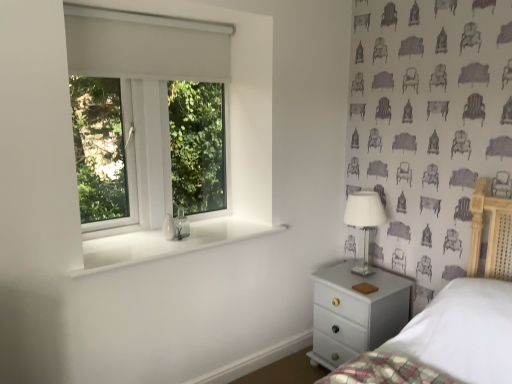
Question: From a real-world perspective, is white glossy chest of drawers at lower right beneath white plastic window at upper left?

Choices:
 (A) no
 (B) yes

Answer: (B)

Question: Is white glossy chest of drawers at lower right positioned before white plastic window at upper left?

Choices:
 (A) yes
 (B) no

Answer: (B)

Question: Does white glossy chest of drawers at lower right touch white plastic window at upper left?

Choices:
 (A) no
 (B) yes

Answer: (A)

Question: From a real-world perspective, is white glossy chest of drawers at lower right on top of white plastic window at upper left?

Choices:
 (A) no
 (B) yes

Answer: (A)

Question: Would you say white glossy chest of drawers at lower right is a long distance from white plastic window at upper left?

Choices:
 (A) no
 (B) yes

Answer: (A)

Question: In the image, is white glossy chest of drawers at lower right positioned in front of or behind white glass table lamp at right?

Choices:
 (A) front
 (B) behind

Answer: (A)

Question: Considering the positions of white glossy chest of drawers at lower right and white glass table lamp at right in the image, is white glossy chest of drawers at lower right taller or shorter than white glass table lamp at right?

Choices:
 (A) tall
 (B) short

Answer: (A)

Question: Is white glossy chest of drawers at lower right to the left or to the right of white glass table lamp at right in the image?

Choices:
 (A) right
 (B) left

Answer: (B)

Question: Is white glossy chest of drawers at lower right wider or thinner than white glass table lamp at right?

Choices:
 (A) wide
 (B) thin

Answer: (A)

Question: Considering the relative positions of white glass table lamp at right and white glossy chest of drawers at lower right in the image provided, is white glass table lamp at right to the left or to the right of white glossy chest of drawers at lower right?

Choices:
 (A) left
 (B) right

Answer: (B)

Question: In terms of height, does white glass table lamp at right look taller or shorter compared to white glossy chest of drawers at lower right?

Choices:
 (A) short
 (B) tall

Answer: (A)

Question: Looking at their shapes, would you say white glass table lamp at right is wider or thinner than white glossy chest of drawers at lower right?

Choices:
 (A) thin
 (B) wide

Answer: (A)

Question: Is point (354, 208) positioned closer to the camera than point (356, 329)?

Choices:
 (A) closer
 (B) farther

Answer: (B)

Question: Considering the positions of white glossy window sill at lower left and white plastic window at upper left in the image, is white glossy window sill at lower left taller or shorter than white plastic window at upper left?

Choices:
 (A) short
 (B) tall

Answer: (A)

Question: In terms of width, does white glossy window sill at lower left look wider or thinner when compared to white plastic window at upper left?

Choices:
 (A) thin
 (B) wide

Answer: (B)